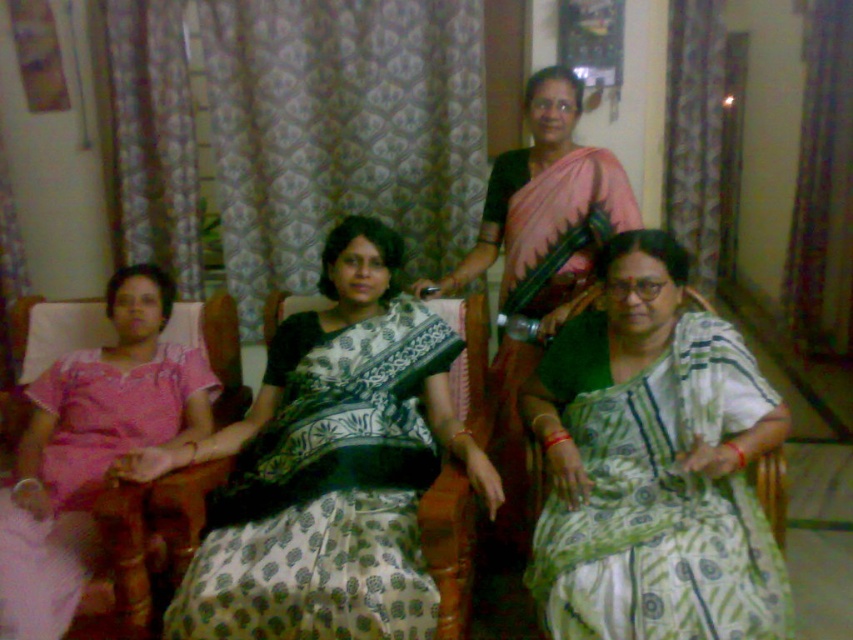
Can you confirm if green printed sari at lower right is thinner than pink silk saree at center?

Indeed, green printed sari at lower right has a lesser width compared to pink silk saree at center.

Can you confirm if green printed sari at lower right is positioned above pink silk saree at center?

Actually, green printed sari at lower right is below pink silk saree at center.

What do you see at coordinates (656, 493) in the screenshot? Image resolution: width=853 pixels, height=640 pixels. I see `green printed sari at lower right` at bounding box center [656, 493].

At what (x,y) coordinates should I click in order to perform the action: click on green printed sari at lower right. Please return your answer as a coordinate pair (x, y). Image resolution: width=853 pixels, height=640 pixels. Looking at the image, I should click on [656, 493].

Is green printed sari at lower right taller than pink cotton dress at left?

No, green printed sari at lower right is not taller than pink cotton dress at left.

This screenshot has width=853, height=640. Find the location of `green printed sari at lower right`. green printed sari at lower right is located at coordinates (656, 493).

Can you confirm if white printed fabric dress at center is wider than pink cotton dress at left?

Correct, the width of white printed fabric dress at center exceeds that of pink cotton dress at left.

Which is behind, point (235, 518) or point (169, 291)?

Point (169, 291)

Locate an element on the screen. white printed fabric dress at center is located at coordinates 326,492.

Where is `white printed fabric dress at center`? The width and height of the screenshot is (853, 640). white printed fabric dress at center is located at coordinates (326, 492).